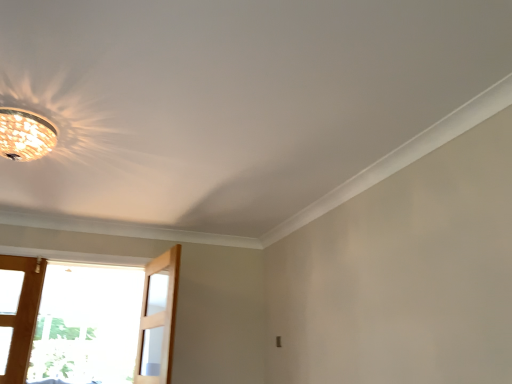
Question: In terms of width, does clear glass screen door at lower left look wider or thinner when compared to matte glass chandelier at upper left?

Choices:
 (A) thin
 (B) wide

Answer: (A)

Question: Would you say clear glass screen door at lower left is inside or outside matte glass chandelier at upper left?

Choices:
 (A) inside
 (B) outside

Answer: (B)

Question: In the image, is clear glass screen door at lower left positioned in front of or behind matte glass chandelier at upper left?

Choices:
 (A) behind
 (B) front

Answer: (A)

Question: Looking at their shapes, would you say matte glass chandelier at upper left is wider or thinner than clear glass screen door at lower left?

Choices:
 (A) wide
 (B) thin

Answer: (A)

Question: In the image, is matte glass chandelier at upper left positioned in front of or behind clear glass screen door at lower left?

Choices:
 (A) front
 (B) behind

Answer: (A)

Question: Is matte glass chandelier at upper left to the left or to the right of clear glass screen door at lower left in the image?

Choices:
 (A) left
 (B) right

Answer: (A)

Question: Is matte glass chandelier at upper left inside the boundaries of clear glass screen door at lower left, or outside?

Choices:
 (A) outside
 (B) inside

Answer: (A)